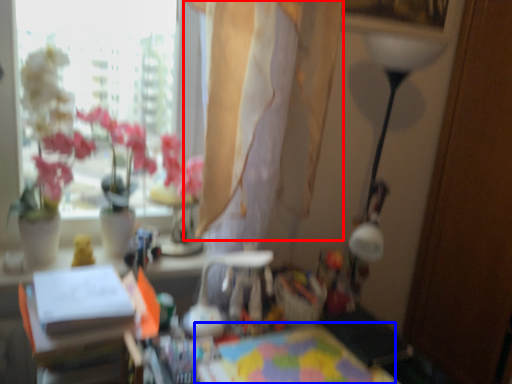
Question: Which object appears farthest to the camera in this image, curtain (highlighted by a red box) or table (highlighted by a blue box)?

Choices:
 (A) curtain
 (B) table

Answer: (A)